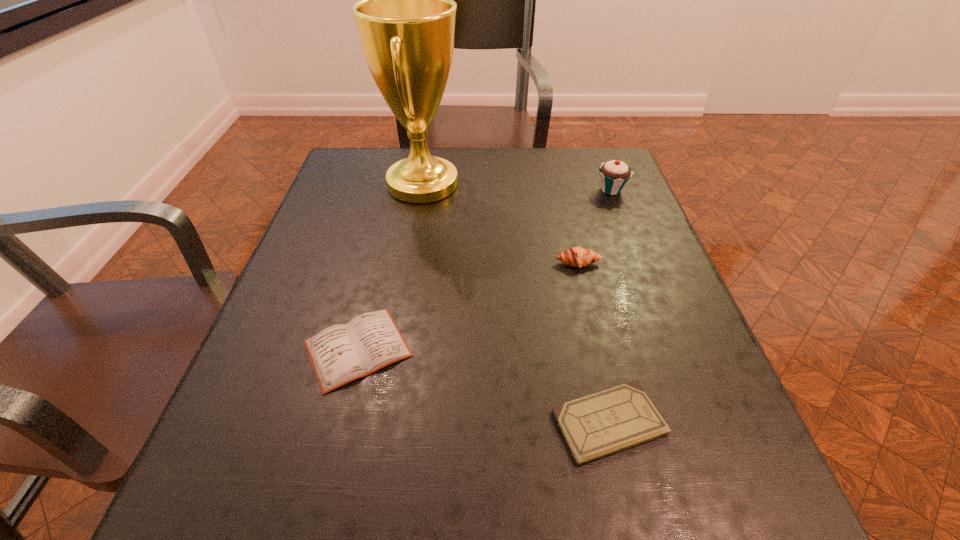
What are the coordinates of `object that is at the far right corner` in the screenshot? It's located at (614, 174).

Identify the location of vacant area at the far edge of the desktop. (536, 161).

This screenshot has height=540, width=960. What are the coordinates of `free space at the near edge of the desktop` in the screenshot? It's located at (418, 526).

The height and width of the screenshot is (540, 960). In the image, there is a desktop. What are the coordinates of `vacant area at the left edge` in the screenshot? It's located at (x=283, y=294).

The height and width of the screenshot is (540, 960). What are the coordinates of `vacant area at the right edge of the desktop` in the screenshot? It's located at (659, 245).

Find the location of a particular element. vacant space at the far left corner of the desktop is located at coordinates (379, 148).

Find the location of a particular element. vacant space at the far right corner of the desktop is located at coordinates (590, 147).

You are a GUI agent. You are given a task and a screenshot of the screen. Output one action in this format:
    pyautogui.click(x=<x>, y=<y>)
    Task: Click on the free space between the checkbook and the rightmost object
    Image resolution: width=960 pixels, height=540 pixels.
    Given the screenshot: What is the action you would take?
    pyautogui.click(x=610, y=306)

At what (x,y) coordinates should I click in order to perform the action: click on free space between the third tallest object and the checkbook. Please return your answer as a coordinate pair (x, y). The height and width of the screenshot is (540, 960). Looking at the image, I should click on (593, 343).

Where is `unoccupied position between the third nearest object and the checkbook`? unoccupied position between the third nearest object and the checkbook is located at coordinates (593, 343).